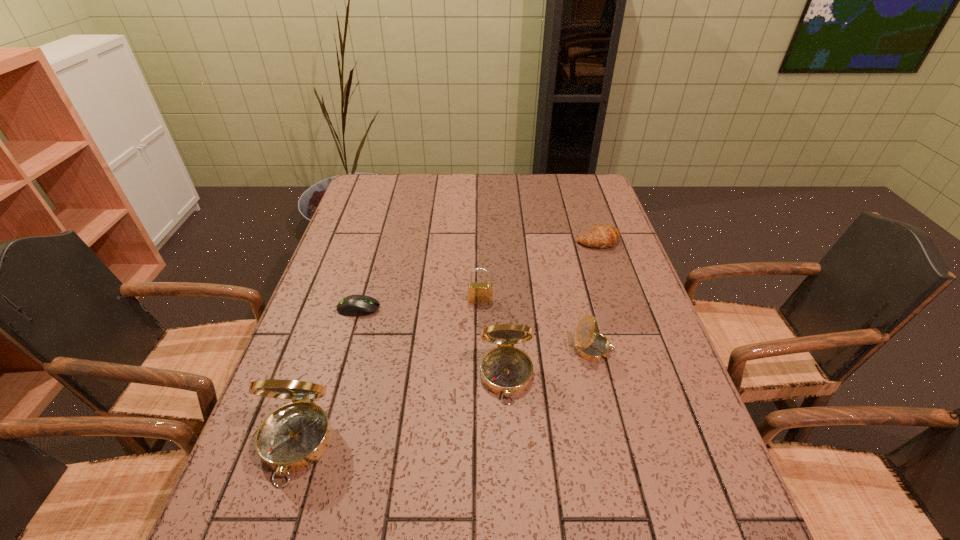
Where is `vacant region that satisfies the following two spatial constraints: 1. with the dial facing the shortest compass; 2. with the dial facing the second tallest compass`? Image resolution: width=960 pixels, height=540 pixels. vacant region that satisfies the following two spatial constraints: 1. with the dial facing the shortest compass; 2. with the dial facing the second tallest compass is located at coordinates (601, 377).

Where is `blank area in the image that satisfies the following two spatial constraints: 1. on the front-facing side of the padlock; 2. on the wheel side of the computer mouse`? blank area in the image that satisfies the following two spatial constraints: 1. on the front-facing side of the padlock; 2. on the wheel side of the computer mouse is located at coordinates (481, 308).